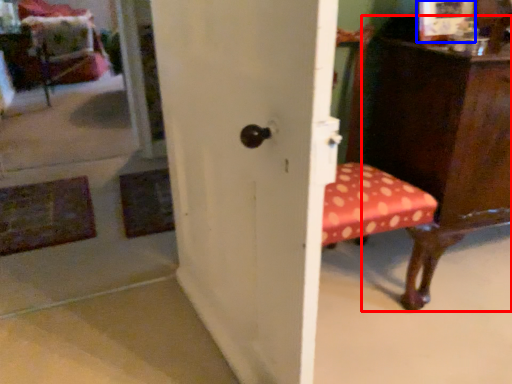
Question: Among these objects, which one is nearest to the camera, furniture (highlighted by a red box) or picture frame (highlighted by a blue box)?

Choices:
 (A) furniture
 (B) picture frame

Answer: (A)